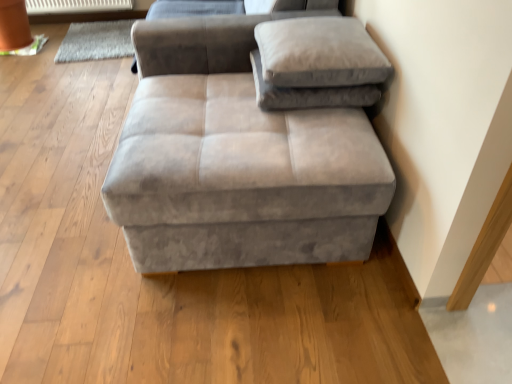
Question: From a real-world perspective, does suede gray ottoman at center sit lower than gray woolen mat at upper left?

Choices:
 (A) yes
 (B) no

Answer: (B)

Question: Is suede gray ottoman at center positioned with its back to gray woolen mat at upper left?

Choices:
 (A) yes
 (B) no

Answer: (B)

Question: Can you confirm if suede gray ottoman at center is wider than gray woolen mat at upper left?

Choices:
 (A) yes
 (B) no

Answer: (A)

Question: Is suede gray ottoman at center far from gray woolen mat at upper left?

Choices:
 (A) yes
 (B) no

Answer: (A)

Question: Is the surface of suede gray ottoman at center in direct contact with gray woolen mat at upper left?

Choices:
 (A) no
 (B) yes

Answer: (A)

Question: From the image's perspective, does suede gray ottoman at center appear higher than gray woolen mat at upper left?

Choices:
 (A) no
 (B) yes

Answer: (A)

Question: Considering the relative positions of suede gray ottoman at center and suede-like beige pillow at upper right, which appears as the 2th pillow when ordered from the bottom, in the image provided, is suede gray ottoman at center to the left of suede-like beige pillow at upper right, which appears as the 2th pillow when ordered from the bottom, from the viewer's perspective?

Choices:
 (A) yes
 (B) no

Answer: (A)

Question: Is suede gray ottoman at center further to camera compared to suede-like beige pillow at upper right, which appears as the 2th pillow when ordered from the bottom?

Choices:
 (A) no
 (B) yes

Answer: (A)

Question: Does suede gray ottoman at center have a lesser width compared to suede-like beige pillow at upper right, which appears as the 2th pillow when ordered from the bottom?

Choices:
 (A) no
 (B) yes

Answer: (A)

Question: Can we say suede gray ottoman at center lies outside suede-like beige pillow at upper right, which appears as the 2th pillow when ordered from the bottom?

Choices:
 (A) no
 (B) yes

Answer: (B)

Question: From the image's perspective, does suede gray ottoman at center appear higher than suede-like beige pillow at upper right, the first pillow when ordered from top to bottom?

Choices:
 (A) no
 (B) yes

Answer: (A)

Question: Is suede gray ottoman at center placed right next to suede-like beige pillow at upper right, which appears as the 2th pillow when ordered from the bottom?

Choices:
 (A) no
 (B) yes

Answer: (A)

Question: Is suede gray ottoman at center wider than suede gray pillow at upper right, placed as the first pillow when sorted from bottom to top?

Choices:
 (A) no
 (B) yes

Answer: (B)